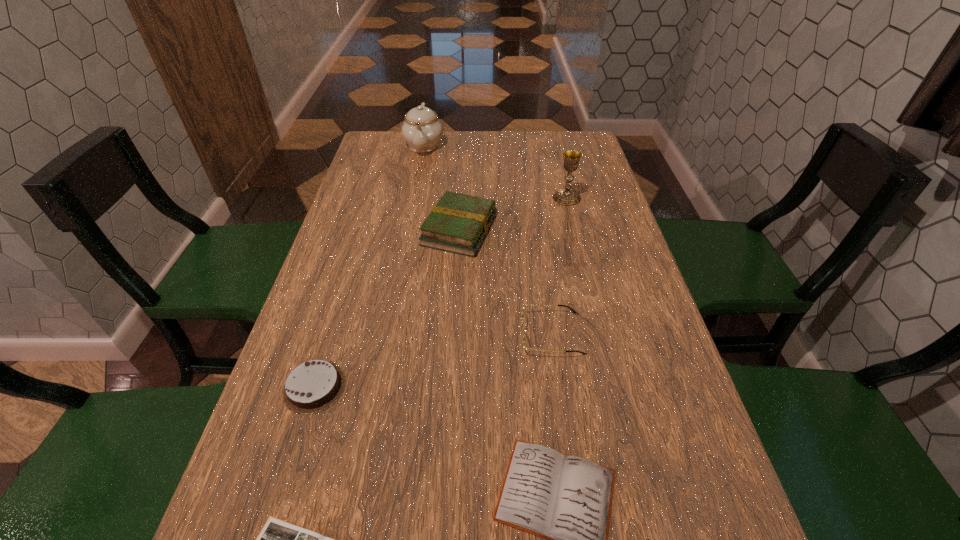
In the image, there is a desktop. At what (x,y) coordinates should I click in order to perform the action: click on free space at the far edge. Please return your answer as a coordinate pair (x, y). The height and width of the screenshot is (540, 960). Looking at the image, I should click on (510, 139).

Locate an element on the screen. Image resolution: width=960 pixels, height=540 pixels. vacant space at the left edge of the desktop is located at coordinates (355, 253).

This screenshot has height=540, width=960. I want to click on vacant space at the right edge of the desktop, so click(x=652, y=338).

The image size is (960, 540). In the image, there is a desktop. In order to click on blank space at the far left corner in this screenshot , I will do `click(362, 165)`.

In the image, there is a desktop. Where is `free region at the far right corner`? free region at the far right corner is located at coordinates (573, 141).

Image resolution: width=960 pixels, height=540 pixels. I want to click on empty location between the farthest object and the third tallest object, so (442, 187).

Where is `unoccupied area between the chalice and the farthest object`? The width and height of the screenshot is (960, 540). unoccupied area between the chalice and the farthest object is located at coordinates (495, 172).

Select which object is the second closest to the chalice. Please provide its 2D coordinates. Your answer should be formatted as a tuple, i.e. [(x, y)], where the tuple contains the x and y coordinates of a point satisfying the conditions above.

[(422, 130)]

You are a GUI agent. You are given a task and a screenshot of the screen. Output one action in this format:
    pyautogui.click(x=<x>, y=<y>)
    Task: Click on the object that stands as the fifth closest to the taller book
    The width and height of the screenshot is (960, 540).
    Given the screenshot: What is the action you would take?
    pyautogui.click(x=567, y=500)

Locate an element on the screen. This screenshot has height=540, width=960. free space in the image that satisfies the following two spatial constraints: 1. at the spout of the farther book; 2. on the left side of the chinaware is located at coordinates (408, 230).